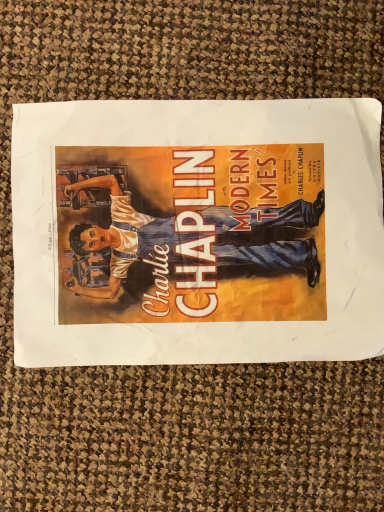
Question: Should I look upward or downward to see matte paper poster at center?

Choices:
 (A) down
 (B) up

Answer: (B)